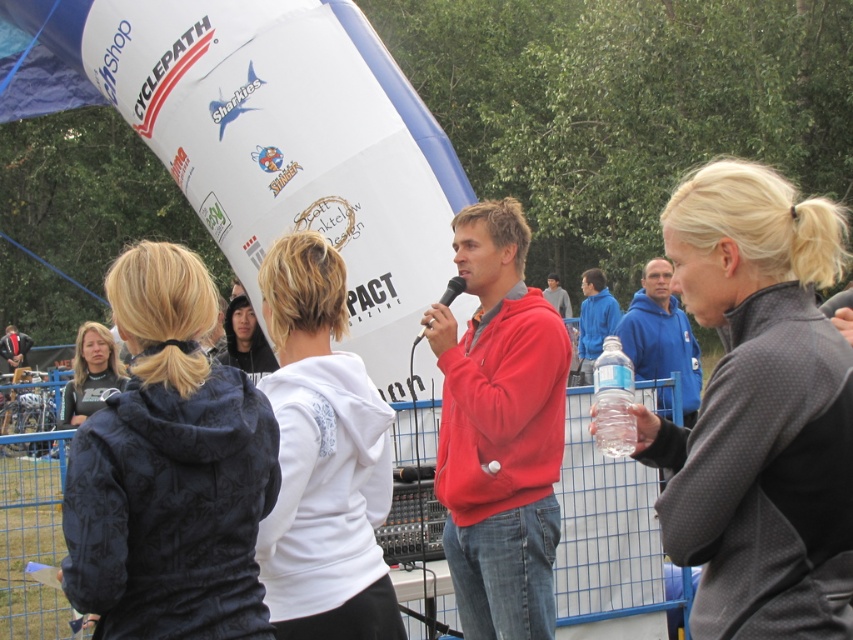
Consider the image. You are a photographer standing at the center of the event area. You need to capture a photo that includes both the clear plastic bottle at lower right and the matte black jacket at lower left. Given their distance apart, do you think you can fit both in your camera frame without moving your position?

The clear plastic bottle at lower right and the matte black jacket at lower left are 23.38 meters apart from each other. Depending on your camera lens, if it has a wide enough angle or zoom capability to capture a 23.38 meter span from your current position, then yes, both can be included. Otherwise, you might need a different lens or adjust your position.

You are a photographer at the event and want to capture a photo of both the dark gray fleece jacket at right and the clear plastic bottle at lower right. Which object should you focus on first to ensure both are in frame?

You should focus on the dark gray fleece jacket at right first because it is taller than the clear plastic bottle at lower right, ensuring it fits within the frame while the smaller bottle remains in view.

You are organizing a small event and need to decide whether to place a large sign next to the dark gray fleece jacket at right and the black plastic microphone at center. Since the sign requires 1.2 meters of space, will the available space between them be sufficient?

The dark gray fleece jacket at right is wider than the black plastic microphone at center. However, the exact distance between them isn